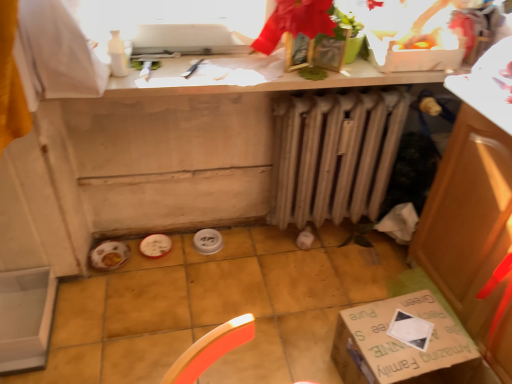
Question: Is beige metallic radiator at center turned away from white matte countertop at upper center?

Choices:
 (A) no
 (B) yes

Answer: (A)

Question: Is beige metallic radiator at center next to white matte countertop at upper center and touching it?

Choices:
 (A) yes
 (B) no

Answer: (B)

Question: Can you confirm if beige metallic radiator at center is positioned to the right of white matte countertop at upper center?

Choices:
 (A) no
 (B) yes

Answer: (B)

Question: Could you tell me if beige metallic radiator at center is facing white matte countertop at upper center?

Choices:
 (A) no
 (B) yes

Answer: (A)

Question: Is the position of beige metallic radiator at center less distant than that of white matte countertop at upper center?

Choices:
 (A) yes
 (B) no

Answer: (B)

Question: From the image's perspective, is beige metallic radiator at center over white matte countertop at upper center?

Choices:
 (A) no
 (B) yes

Answer: (A)

Question: From the image's perspective, is white plastic box at upper center below green cardboard box at lower right?

Choices:
 (A) no
 (B) yes

Answer: (A)

Question: Considering the relative positions of white plastic box at upper center and green cardboard box at lower right in the image provided, is white plastic box at upper center in front of green cardboard box at lower right?

Choices:
 (A) yes
 (B) no

Answer: (B)

Question: Considering the relative sizes of white plastic box at upper center and green cardboard box at lower right in the image provided, is white plastic box at upper center bigger than green cardboard box at lower right?

Choices:
 (A) no
 (B) yes

Answer: (A)

Question: Is green cardboard box at lower right at the back of white plastic box at upper center?

Choices:
 (A) no
 (B) yes

Answer: (A)

Question: Considering the relative positions of white plastic box at upper center and green cardboard box at lower right in the image provided, is white plastic box at upper center to the right of green cardboard box at lower right from the viewer's perspective?

Choices:
 (A) yes
 (B) no

Answer: (A)

Question: From a real-world perspective, is white plastic box at upper center below green cardboard box at lower right?

Choices:
 (A) no
 (B) yes

Answer: (A)

Question: Is white plastic box at upper center positioned with its back to white matte countertop at upper center?

Choices:
 (A) yes
 (B) no

Answer: (B)